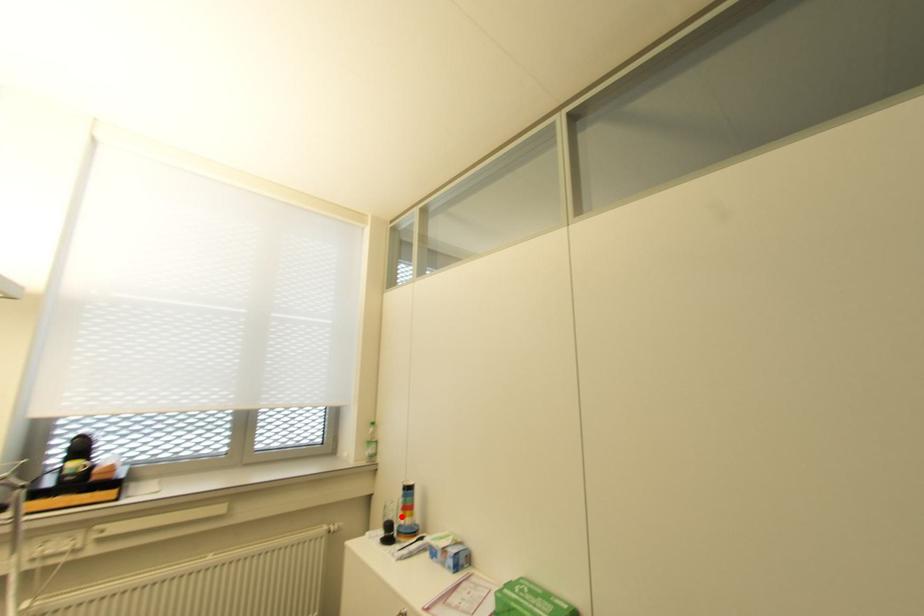
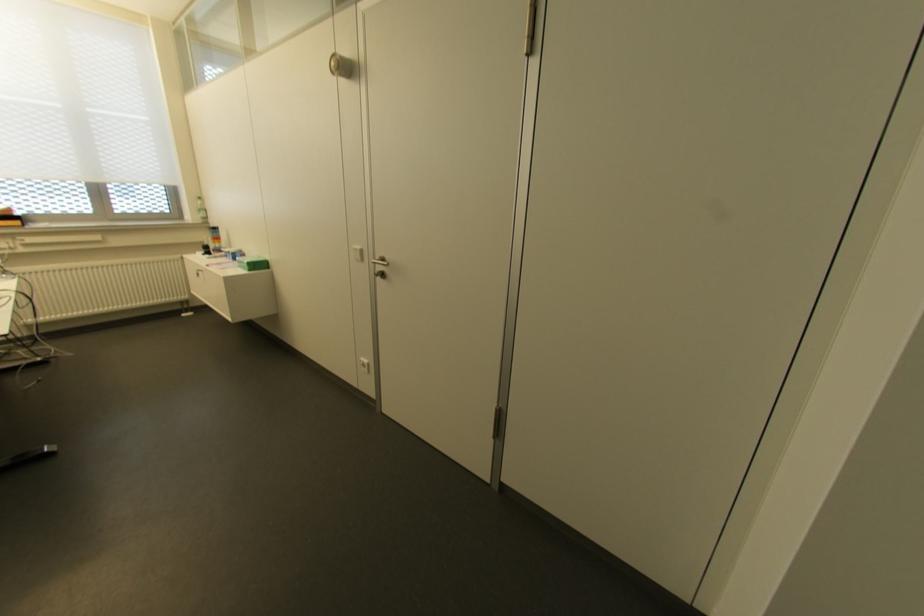
Where in the second image is the point corresponding to the highlighted location from the first image?

(213, 243)